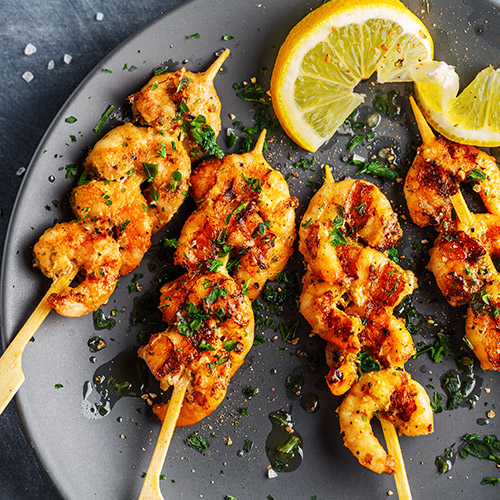
This screenshot has height=500, width=500. In order to click on gray dinner plate in this screenshot , I will do `click(96, 455)`.